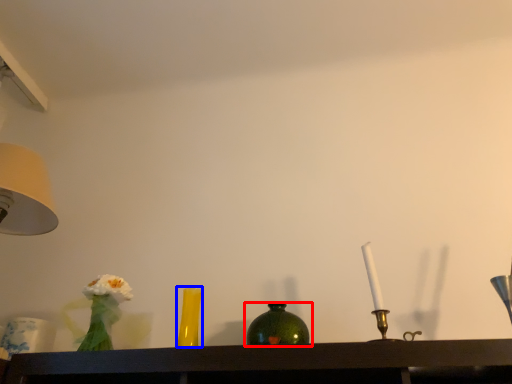
Question: Which object is further to the camera taking this photo, bottle (highlighted by a red box) or vase (highlighted by a blue box)?

Choices:
 (A) bottle
 (B) vase

Answer: (B)